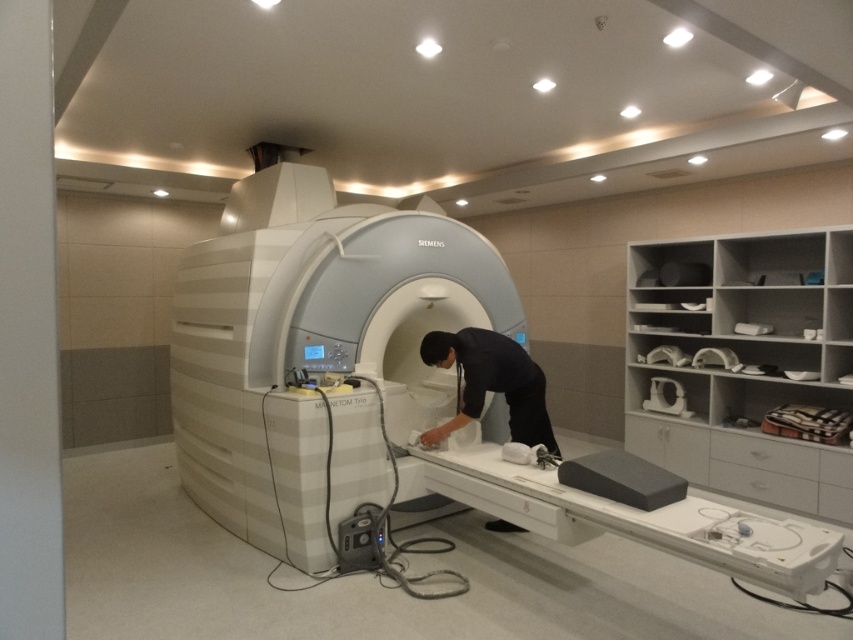
Question: Can you confirm if white plastic mri machine at center is thinner than black fabric at center?

Choices:
 (A) no
 (B) yes

Answer: (A)

Question: Which point is closer to the camera?

Choices:
 (A) black fabric at center
 (B) white plastic mri machine at center

Answer: (B)

Question: Does white plastic mri machine at center appear over black fabric at center?

Choices:
 (A) yes
 (B) no

Answer: (B)

Question: Does white plastic mri machine at center appear on the left side of black fabric at center?

Choices:
 (A) yes
 (B) no

Answer: (A)